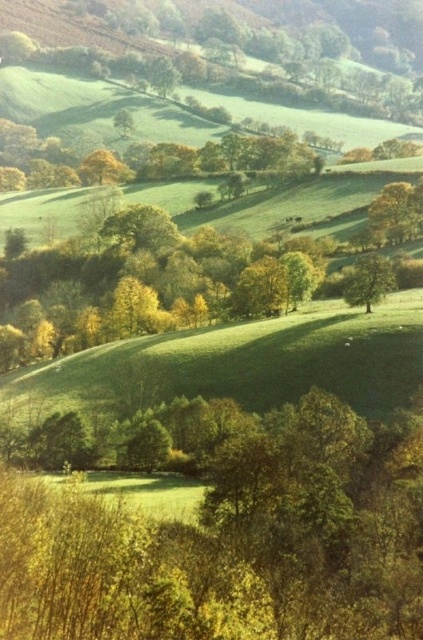
Question: Which of the following is the closest to the observer?

Choices:
 (A) green leafy tree at center-right
 (B) green leafy tree at lower left
 (C) green leafy tree at center
 (D) green leafy tree at upper right

Answer: (B)

Question: Estimate the real-world distances between objects in this image. Which object is closer to the green leafy tree at lower left?

Choices:
 (A) green leafy tree at center-right
 (B) green leafy tree at center

Answer: (A)

Question: Can you confirm if green leafy tree at upper right is positioned to the right of green leafy tree at center-right?

Choices:
 (A) no
 (B) yes

Answer: (B)

Question: Which point appears closest to the camera in this image?

Choices:
 (A) (379, 236)
 (B) (379, 280)
 (C) (102, 300)
 (D) (192, 436)

Answer: (D)

Question: Observing the image, what is the correct spatial positioning of green leafy tree at upper right in reference to green leafy tree at center-right?

Choices:
 (A) below
 (B) above

Answer: (B)

Question: Can you confirm if green leafy tree at lower left is positioned above green leafy tree at upper right?

Choices:
 (A) no
 (B) yes

Answer: (A)